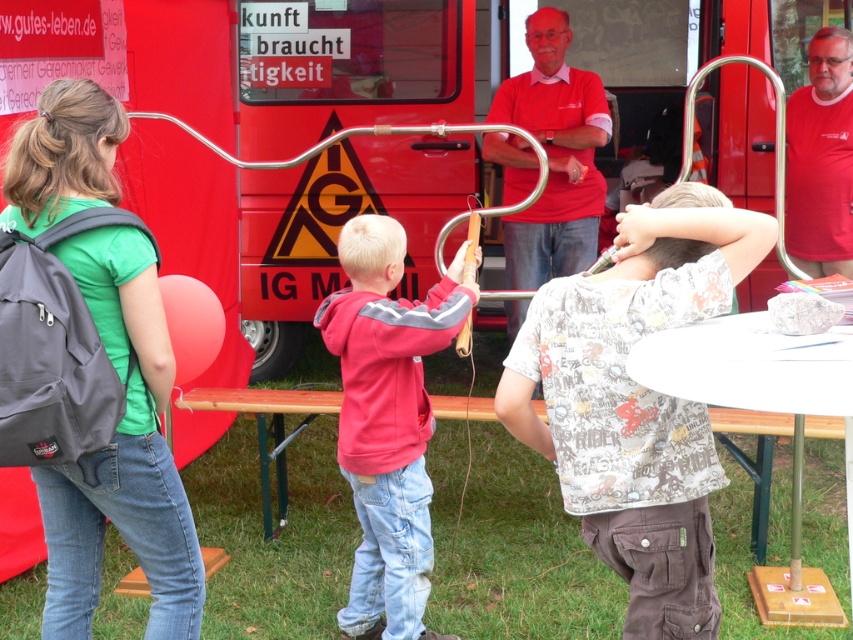
You are a safety officer at the event and need to ensure that the two children near the curved metal object are within a safe distance of each other. According to the safety protocol, children must be at least 5 feet apart to avoid overcrowding. Can you confirm if the red fleece hoodie at center and the matte red shirt at center are compliant with this requirement?

The distance between the red fleece hoodie at center and the matte red shirt at center is 7.46 feet, which exceeds the minimum required 5 feet. Therefore, they are compliant with the safety protocol.

You are standing at the point labeled point (x=584, y=108) and want to move to the point labeled point (x=368, y=220). Which direction should you move in to reach your destination?

You should move forward to reach point (x=368, y=220) from point (x=584, y=108) since it is in front of you.